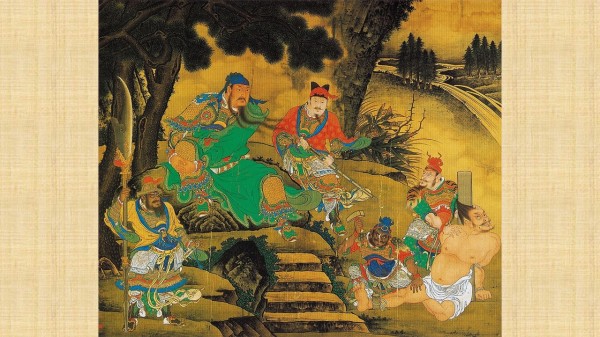
Where is `plant`? This screenshot has height=337, width=600. plant is located at coordinates (398, 143).